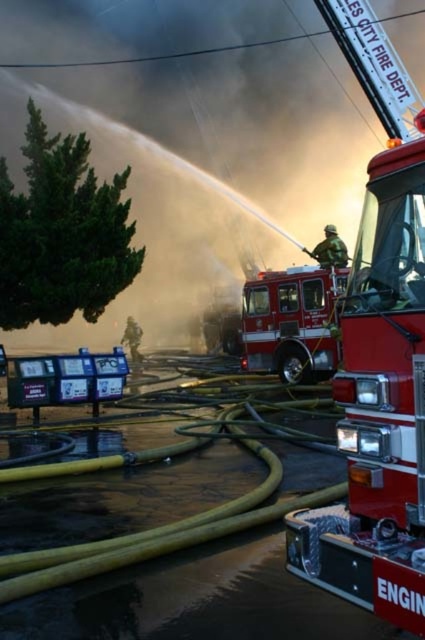
From the picture: Between red fire truck at center and green matte uniform at center, which one appears on the right side from the viewer's perspective?

green matte uniform at center

Identify the location of red fire truck at center. (377, 360).

Which is in front, point (402, 276) or point (331, 236)?

Point (402, 276)

Where is `red fire truck at center`? red fire truck at center is located at coordinates (377, 360).

Which is behind, point (57, 566) or point (135, 346)?

The point (135, 346) is more distant.

Can you confirm if yellow rubber hose at center is wider than camouflage uniform fireman at center?

In fact, yellow rubber hose at center might be narrower than camouflage uniform fireman at center.

Identify the location of yellow rubber hose at center. (158, 532).

Which of these two, red fire truck at center or shiny red fire truck at center, stands shorter?

Standing shorter between the two is shiny red fire truck at center.

Is red fire truck at center closer to the viewer compared to shiny red fire truck at center?

Yes.

Which is behind, point (397, 532) or point (317, 307)?

The point (317, 307) is behind.

You are a GUI agent. You are given a task and a screenshot of the screen. Output one action in this format:
    pyautogui.click(x=<x>, y=<y>)
    Task: Click on the red fire truck at center
    Image resolution: width=425 pixels, height=640 pixels.
    Given the screenshot: What is the action you would take?
    pyautogui.click(x=377, y=360)